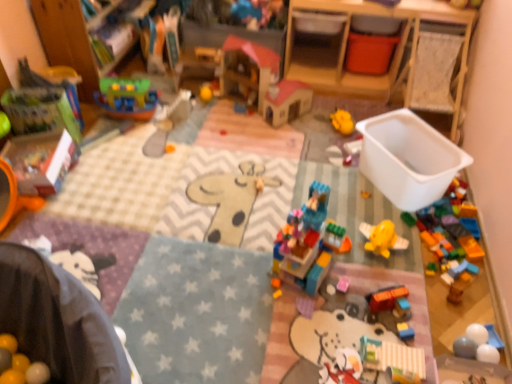
What are the coordinates of `vacant space behind translucent plastic airplane at center, placed as the fourth toy when sorted from bottom to top` in the screenshot? It's located at [351, 173].